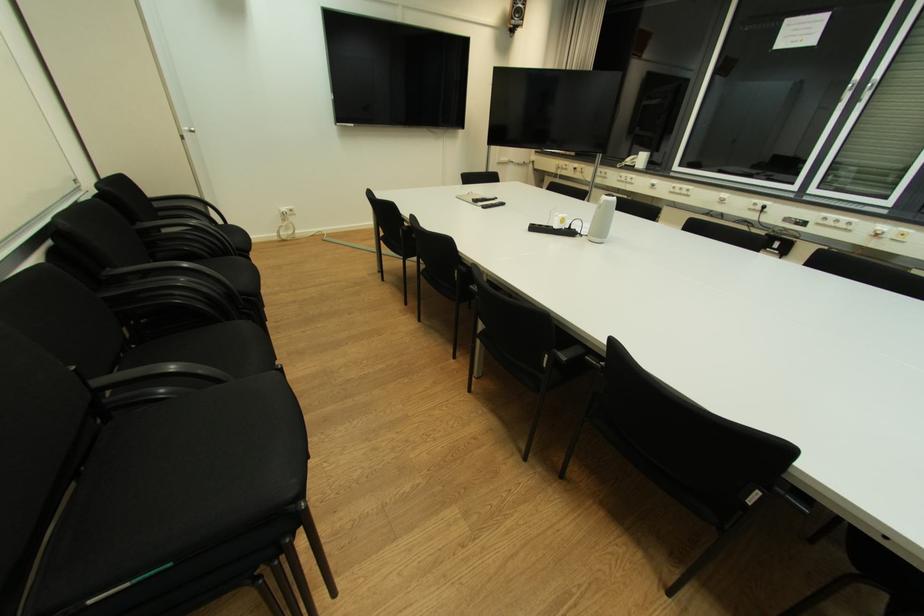
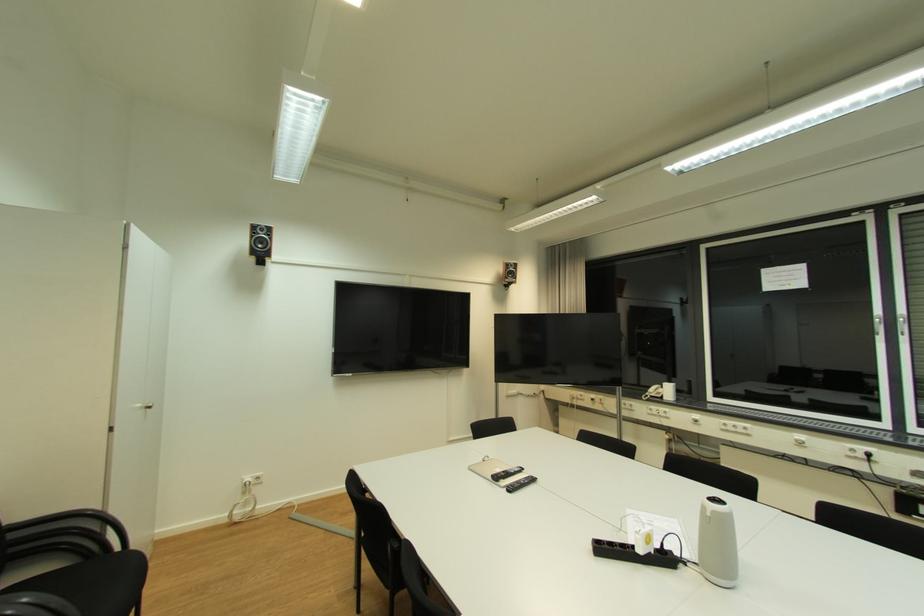
Locate, in the second image, the point that corresponds to (x=191, y=129) in the first image.

(146, 407)